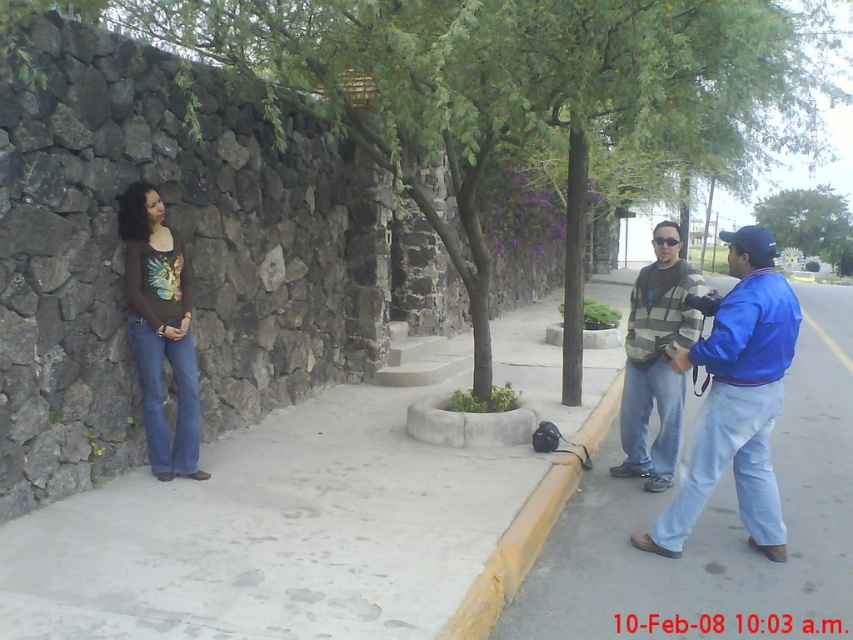
You are standing at the point marked as point (451, 182) in the image. If you want to take a photo of the three people in the street scene, will you be able to capture them all in the frame without moving?

The point (451, 182) is 30.56 feet away from the camera. Since the three people are within the same general area of the street scene, it is likely that they can all be captured in the frame from this distance without needing to move.

You are a photographer trying to capture a clear shot of the striped knit sweater at center without the green leafy tree at center blocking it. What adjustment should you make to your position?

Move your camera position backward since the green leafy tree at center is closer to the viewer than the striped knit sweater at center, allowing you to frame the sweater without the tree obstructing it.